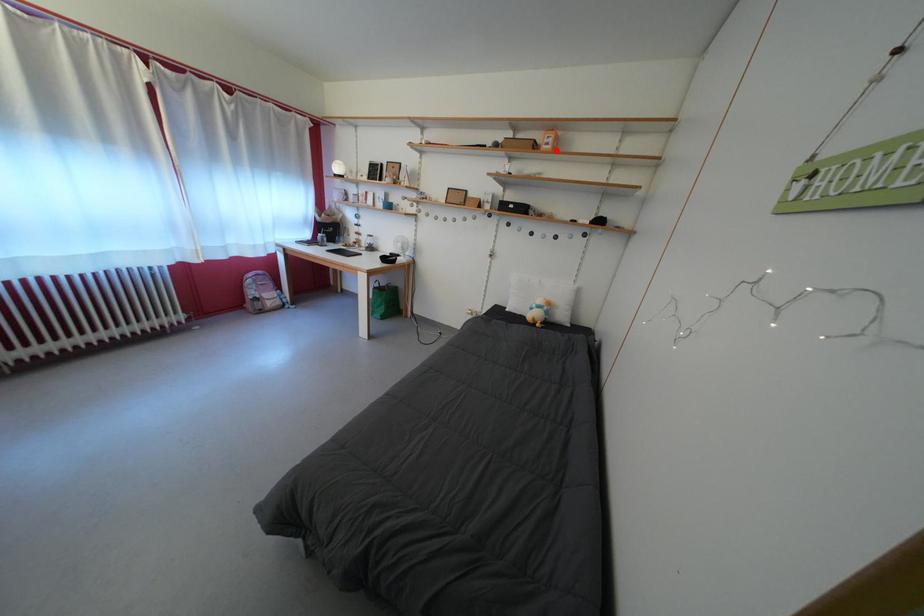
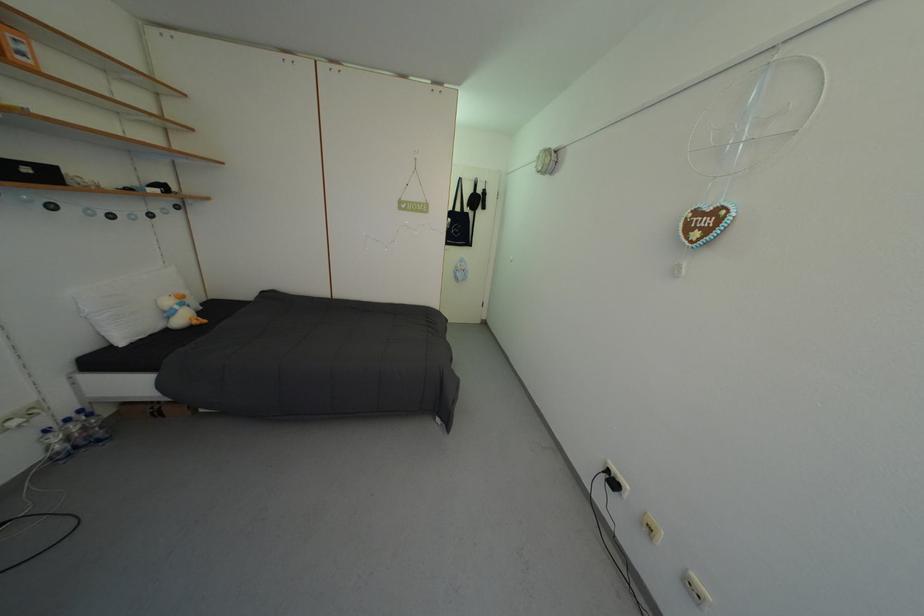
The point at the highlighted location is marked in the first image. Where is the corresponding point in the second image?

(30, 60)